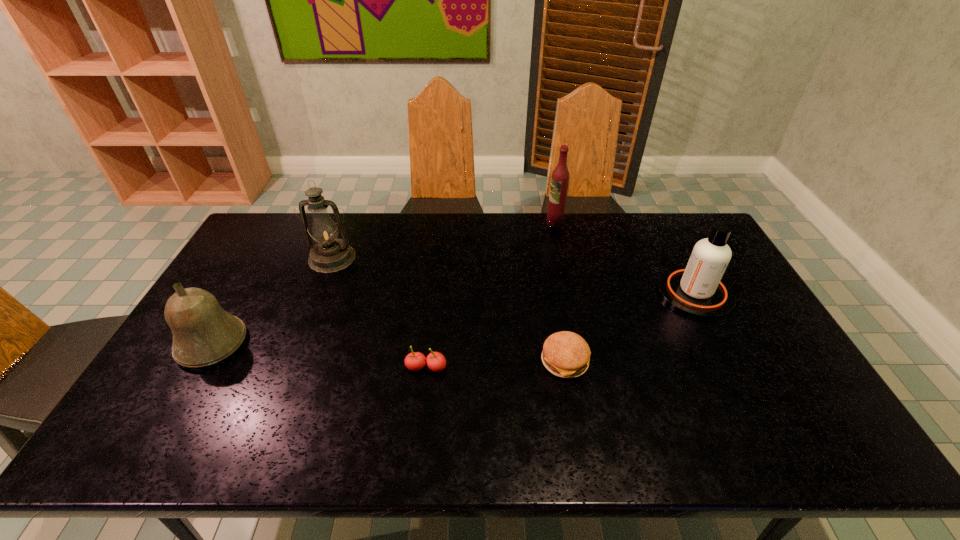
You are a GUI agent. You are given a task and a screenshot of the screen. Output one action in this format:
    pyautogui.click(x=<x>, y=<y>)
    Task: Click on the free region located on the front of the rightmost object
    The image size is (960, 540).
    Given the screenshot: What is the action you would take?
    pyautogui.click(x=759, y=418)

Locate an element on the screen. This screenshot has height=540, width=960. vacant space located 0.380m on the right of the leftmost object is located at coordinates [x=382, y=343].

Identify the location of vacant space located 0.400m on the right of the cherry. The image size is (960, 540). (598, 368).

At what (x,y) coordinates should I click in order to perform the action: click on vacant point located 0.390m on the back of the hamburger. Please return your answer as a coordinate pair (x, y). This screenshot has height=540, width=960. Looking at the image, I should click on (546, 255).

You are a GUI agent. You are given a task and a screenshot of the screen. Output one action in this format:
    pyautogui.click(x=<x>, y=<y>)
    Task: Click on the liquor located in the far edge section of the desktop
    
    Given the screenshot: What is the action you would take?
    pyautogui.click(x=560, y=177)

I want to click on oil lamp that is at the far edge, so click(x=329, y=255).

Where is `object that is at the left edge`? object that is at the left edge is located at coordinates (203, 333).

In order to click on object present at the right edge in this screenshot , I will do `click(697, 290)`.

In the image, there is a desktop. Identify the location of vacant space at the far edge. (403, 238).

The width and height of the screenshot is (960, 540). I want to click on vacant space at the near edge of the desktop, so click(724, 455).